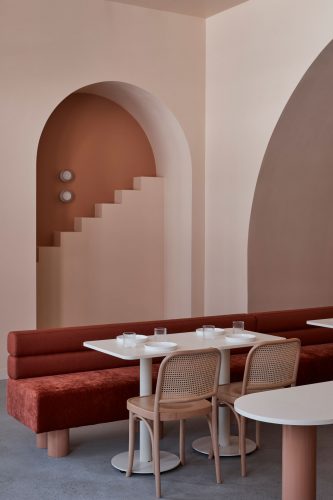
What are the coordinates of `table stand` in the screenshot? It's located at (147, 386).